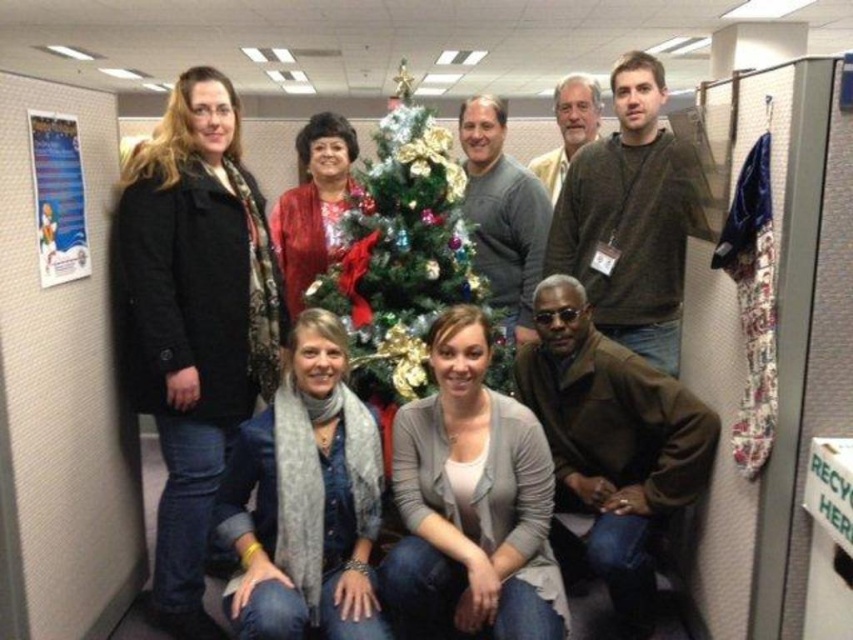
You are an office worker who wants to retrieve your gray scarf at lower center from under the green shiny christmas tree at center. Can you reach it without moving the tree?

The gray scarf at lower center is positioned under the green shiny christmas tree at center, so you can reach it without moving the tree since it is accessible from underneath.

You are a photographer standing 5 feet away from the camera. You want to grab the black matte coat at left to adjust its position for a better shot. Can you reach it without moving from your current position?

The black matte coat at left and camera are 6.58 feet apart. Since you are 5 feet away from the camera, the distance between you and the black matte coat at left is 1.58 feet. Therefore, you can easily reach it without moving.

You are standing in the office and want to place a gift under the Christmas tree. The gift must be placed exactly at the coordinates where the gray scarf at lower center is located. What are the coordinates where you should place the gift?

The coordinates for placing the gift should be at point (305, 500), as that is where the gray scarf at lower center is located.